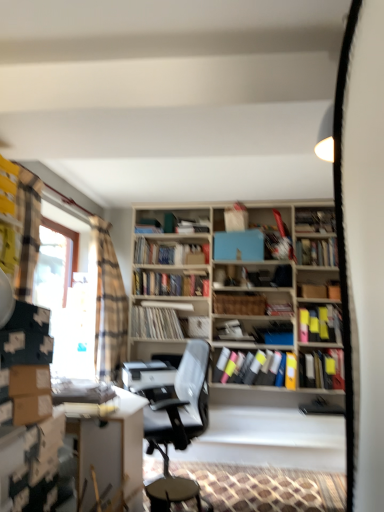
At what (x,y) coordinates should I click in order to perform the action: click on free spot above hardcover books at center, marked as the first book in a top-to-bottom arrangement (from a real-world perspective). Please return your answer as a coordinate pair (x, y). The image size is (384, 512). Looking at the image, I should click on (170, 238).